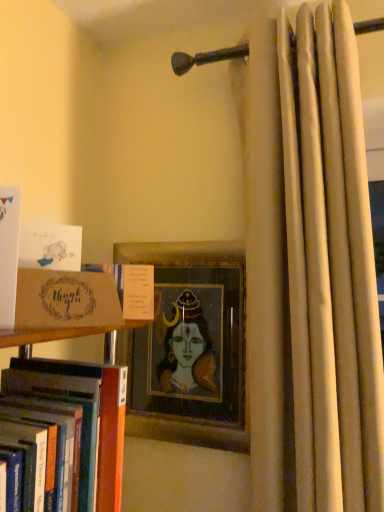
Question: Is beige fabric curtain at right behind matte brown card at left?

Choices:
 (A) no
 (B) yes

Answer: (B)

Question: Is beige fabric curtain at right oriented away from matte brown card at left?

Choices:
 (A) no
 (B) yes

Answer: (A)

Question: From the image's perspective, does beige fabric curtain at right appear higher than matte brown card at left?

Choices:
 (A) no
 (B) yes

Answer: (B)

Question: From the image's perspective, is beige fabric curtain at right located beneath matte brown card at left?

Choices:
 (A) yes
 (B) no

Answer: (B)

Question: Considering the relative sizes of beige fabric curtain at right and matte brown card at left in the image provided, is beige fabric curtain at right taller than matte brown card at left?

Choices:
 (A) no
 (B) yes

Answer: (B)

Question: Considering the positions of matte brown card at left and white matte card at left, which is the third book from bottom to top, in the image, is matte brown card at left bigger or smaller than white matte card at left, which is the third book from bottom to top,?

Choices:
 (A) big
 (B) small

Answer: (A)

Question: Does point [x=104, y=308] appear closer or farther from the camera than point [x=0, y=251]?

Choices:
 (A) closer
 (B) farther

Answer: (B)

Question: Considering the relative positions of matte brown card at left and white matte card at left, arranged as the 2th book when viewed from the top, in the image provided, is matte brown card at left to the left or to the right of white matte card at left, arranged as the 2th book when viewed from the top,?

Choices:
 (A) right
 (B) left

Answer: (A)

Question: From their relative heights in the image, would you say matte brown card at left is taller or shorter than white matte card at left, which is the third book from bottom to top?

Choices:
 (A) short
 (B) tall

Answer: (A)

Question: From the image's perspective, is brown cardboard box at left, the second book ordered from the bottom, above or below wooden picture frame at center?

Choices:
 (A) above
 (B) below

Answer: (A)

Question: Looking at their shapes, would you say brown cardboard box at left, placed as the third book when sorted from top to bottom, is wider or thinner than wooden picture frame at center?

Choices:
 (A) thin
 (B) wide

Answer: (A)

Question: Considering their positions, is brown cardboard box at left, placed as the third book when sorted from top to bottom, located in front of or behind wooden picture frame at center?

Choices:
 (A) front
 (B) behind

Answer: (A)

Question: In terms of height, does brown cardboard box at left, the second book ordered from the bottom, look taller or shorter compared to wooden picture frame at center?

Choices:
 (A) short
 (B) tall

Answer: (A)

Question: Considering the positions of brown cardboard box at left, the second book ordered from the bottom, and white matte card at upper left, which ranks as the 1th book in top-to-bottom order, in the image, is brown cardboard box at left, the second book ordered from the bottom, bigger or smaller than white matte card at upper left, which ranks as the 1th book in top-to-bottom order,?

Choices:
 (A) small
 (B) big

Answer: (B)

Question: From the image's perspective, is brown cardboard box at left, the second book ordered from the bottom, positioned above or below white matte card at upper left, which ranks as the 1th book in top-to-bottom order?

Choices:
 (A) below
 (B) above

Answer: (A)